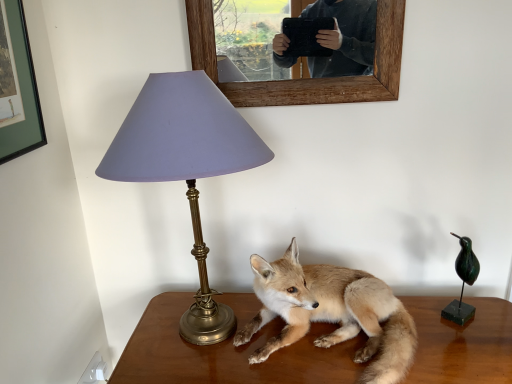
You are a GUI agent. You are given a task and a screenshot of the screen. Output one action in this format:
    pyautogui.click(x=<x>, y=<y>)
    Task: Click on the vacant space underneath furry golden fox at center (from a real-world perspective)
    The image size is (512, 384).
    Given the screenshot: What is the action you would take?
    pyautogui.click(x=326, y=357)